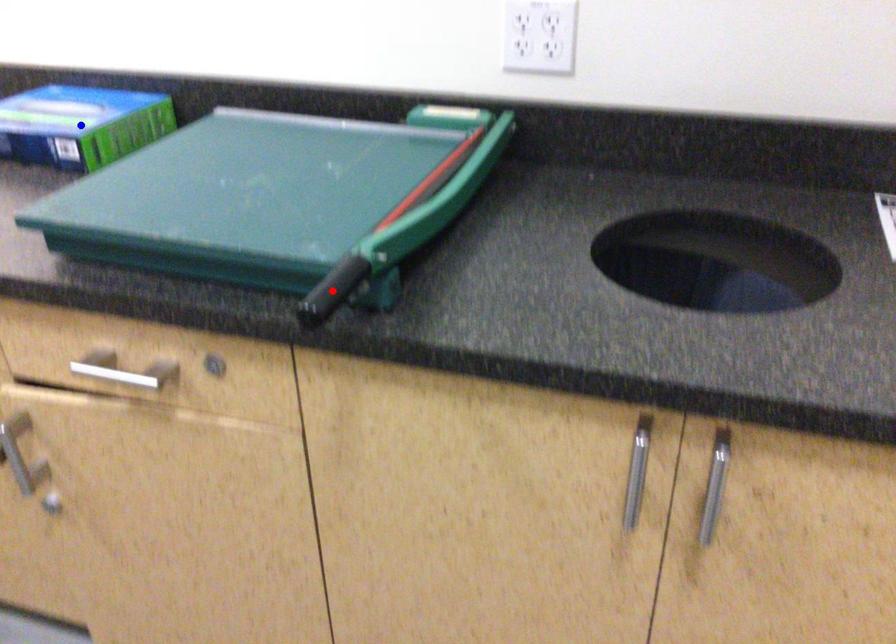
Question: Which of the two points in the image is closer to the camera?

Choices:
 (A) Blue point is closer.
 (B) Red point is closer.

Answer: (B)